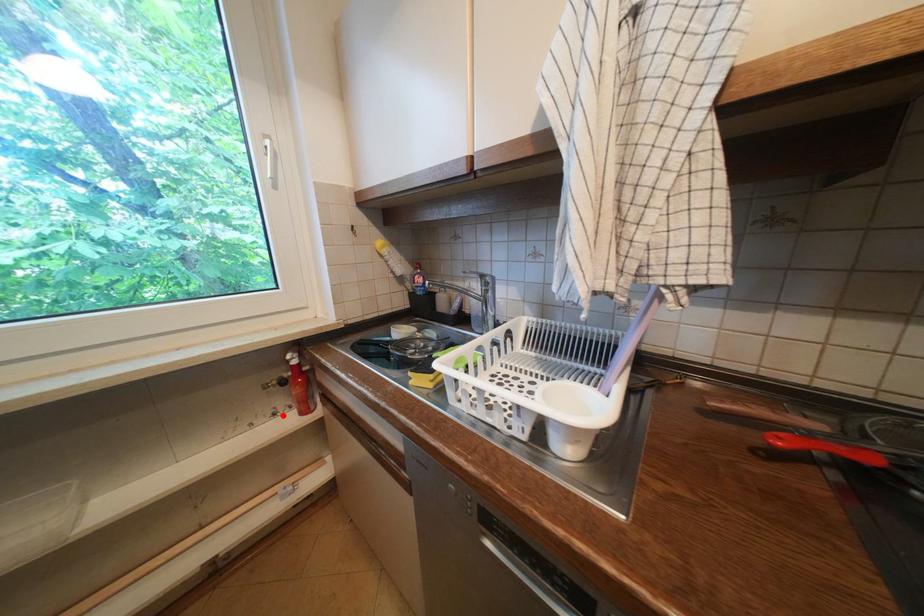
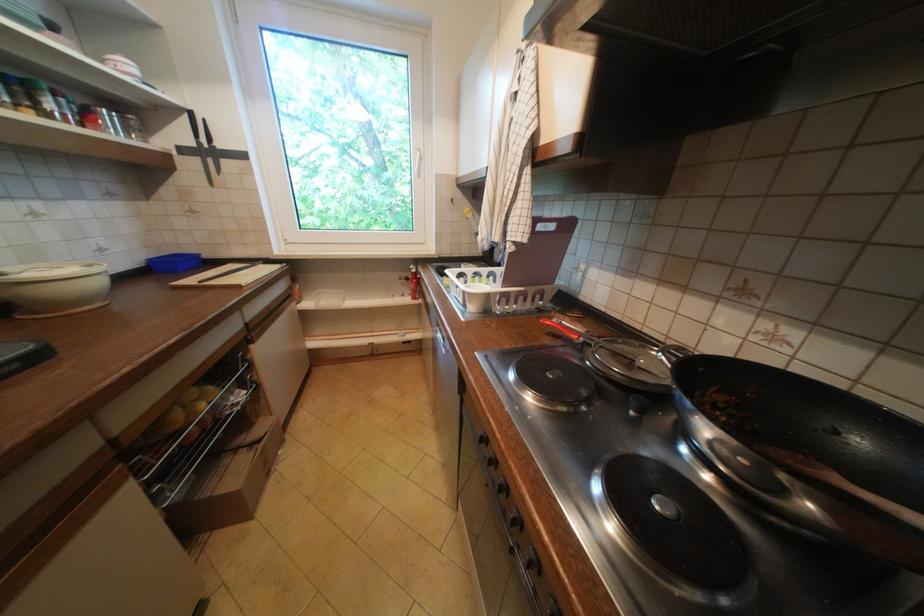
The point at the highlighted location is marked in the first image. Where is the corresponding point in the second image?

(410, 296)